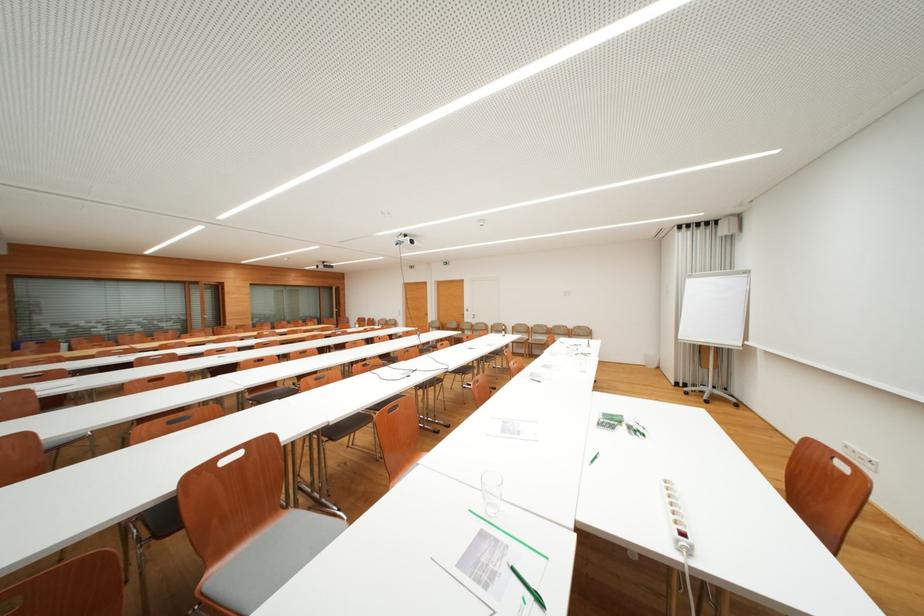
What do you see at coordinates (682, 533) in the screenshot? I see `the red power switch` at bounding box center [682, 533].